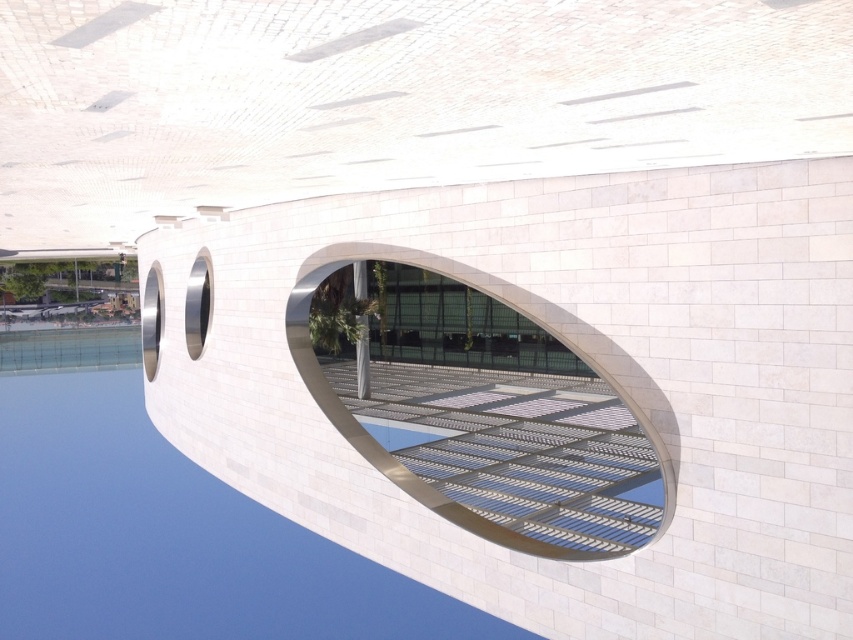
Question: Is transparent glass water at center further to camera compared to metallic silver window at center?

Choices:
 (A) no
 (B) yes

Answer: (B)

Question: From the image, what is the correct spatial relationship of transparent glass water at center in relation to metallic silver window at center?

Choices:
 (A) right
 (B) left

Answer: (B)

Question: Is transparent glass water at center to the left of metallic silver window at center from the viewer's perspective?

Choices:
 (A) no
 (B) yes

Answer: (B)

Question: Which object appears closest to the camera in this image?

Choices:
 (A) transparent glass water at center
 (B) metallic silver window at center

Answer: (B)

Question: Which point is closer to the camera?

Choices:
 (A) (496, 323)
 (B) (181, 616)

Answer: (A)